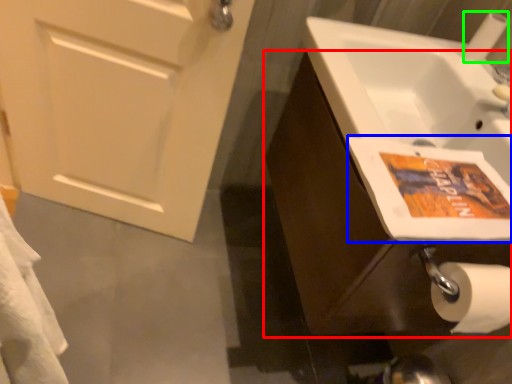
Question: Which is nearer to the bathroom cabinet (highlighted by a red box)? flyer (highlighted by a blue box) or toilet paper (highlighted by a green box).

Choices:
 (A) flyer
 (B) toilet paper

Answer: (A)